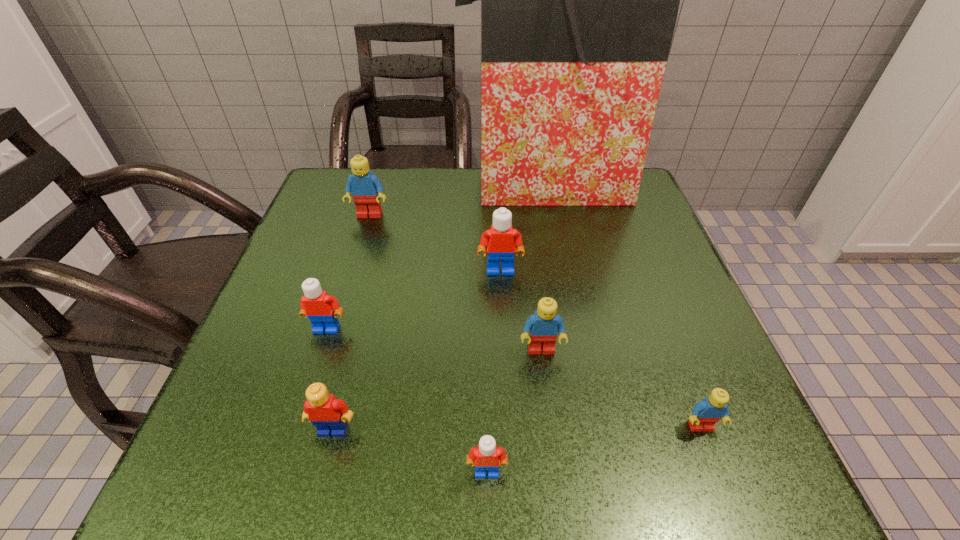
Locate an element on the screen. black shopping bag is located at coordinates (579, 0).

The image size is (960, 540). I want to click on shopping bag, so click(x=579, y=0).

You are a GUI agent. You are given a task and a screenshot of the screen. Output one action in this format:
    pyautogui.click(x=<x>, y=<y>)
    Task: Click on the farthest Lego
    The height and width of the screenshot is (540, 960).
    Given the screenshot: What is the action you would take?
    pyautogui.click(x=366, y=189)

I want to click on the leftmost blue Lego, so click(x=366, y=189).

The width and height of the screenshot is (960, 540). I want to click on the biggest white Lego, so click(x=501, y=239).

Where is `the sixth nearest Lego`? Image resolution: width=960 pixels, height=540 pixels. the sixth nearest Lego is located at coordinates (501, 239).

I want to click on the second blue Lego from right to left, so click(x=543, y=326).

Locate an element on the screen. The image size is (960, 540). the second nearest blue Lego is located at coordinates (543, 326).

This screenshot has width=960, height=540. Identify the location of the fifth nearest object. 318,306.

Locate an element on the screen. Image resolution: width=960 pixels, height=540 pixels. the second nearest white Lego is located at coordinates (318, 306).